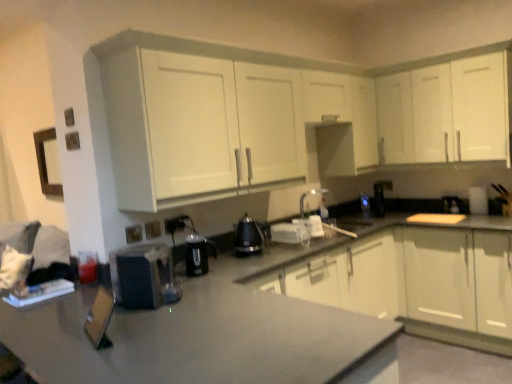
Question: Can you confirm if white matte cabinet at upper center, which is the 2th cabinetry in bottom-to-top order, is positioned to the left of white glossy cabinet at upper right, arranged as the first cabinetry when viewed from the top?

Choices:
 (A) no
 (B) yes

Answer: (B)

Question: Can white glossy cabinet at upper right, positioned as the third cabinetry in bottom-to-top order, be found inside white matte cabinet at upper center, which is the 2th cabinetry in bottom-to-top order?

Choices:
 (A) yes
 (B) no

Answer: (B)

Question: Does white matte cabinet at upper center, which is the 2th cabinetry in bottom-to-top order, have a greater width compared to white glossy cabinet at upper right, positioned as the third cabinetry in bottom-to-top order?

Choices:
 (A) no
 (B) yes

Answer: (B)

Question: From the image's perspective, is white matte cabinet at upper center, which is the 2th cabinetry in bottom-to-top order, on white glossy cabinet at upper right, positioned as the third cabinetry in bottom-to-top order?

Choices:
 (A) no
 (B) yes

Answer: (A)

Question: Can you confirm if white matte cabinet at upper center, positioned as the second cabinetry in top-to-bottom order, is thinner than white glossy cabinet at upper right, positioned as the third cabinetry in bottom-to-top order?

Choices:
 (A) yes
 (B) no

Answer: (B)

Question: Based on their positions, is matte black electric outlet at lower left, arranged as the third electric outlet when viewed from the right, located to the left or right of matte plastic electric outlet at lower center, arranged as the 2th electric outlet when viewed from the right?

Choices:
 (A) left
 (B) right

Answer: (A)

Question: Would you say matte black electric outlet at lower left, which is the first electric outlet in front-to-back order, is inside or outside matte plastic electric outlet at lower center, arranged as the 2th electric outlet when viewed from the right?

Choices:
 (A) outside
 (B) inside

Answer: (A)

Question: Is matte black electric outlet at lower left, positioned as the first electric outlet in left-to-right order, wider or thinner than matte plastic electric outlet at lower center, the 2th electric outlet viewed from the back?

Choices:
 (A) wide
 (B) thin

Answer: (A)

Question: From a real-world perspective, is matte black electric outlet at lower left, positioned as the first electric outlet in left-to-right order, above or below matte plastic electric outlet at lower center, the 2th electric outlet viewed from the back?

Choices:
 (A) below
 (B) above

Answer: (B)

Question: From a real-world perspective, relative to black plastic coffee maker at lower left, the fifth appliance viewed from the back, is white glossy cabinets at center, marked as the first cabinetry in a bottom-to-top arrangement, vertically above or below?

Choices:
 (A) above
 (B) below

Answer: (B)

Question: Is white glossy cabinets at center, which is the 3th cabinetry from top to bottom, bigger or smaller than black plastic coffee maker at lower left, positioned as the 2th appliance in left-to-right order?

Choices:
 (A) big
 (B) small

Answer: (A)

Question: Relative to black plastic coffee maker at lower left, positioned as the 2th appliance in left-to-right order, is white glossy cabinets at center, marked as the first cabinetry in a bottom-to-top arrangement, in front or behind?

Choices:
 (A) behind
 (B) front

Answer: (A)

Question: Considering the positions of white glossy cabinets at center, marked as the first cabinetry in a bottom-to-top arrangement, and black plastic coffee maker at lower left, which is the 5th appliance from right to left, in the image, is white glossy cabinets at center, marked as the first cabinetry in a bottom-to-top arrangement, wider or thinner than black plastic coffee maker at lower left, which is the 5th appliance from right to left,?

Choices:
 (A) thin
 (B) wide

Answer: (B)

Question: From a real-world perspective, is white glossy cabinet at upper right, positioned as the third cabinetry in bottom-to-top order, positioned above or below white glossy kettle at center, which appears as the 2th appliance when viewed from the right?

Choices:
 (A) below
 (B) above

Answer: (B)

Question: Considering the positions of point (392, 134) and point (304, 213), is point (392, 134) closer or farther from the camera than point (304, 213)?

Choices:
 (A) farther
 (B) closer

Answer: (B)